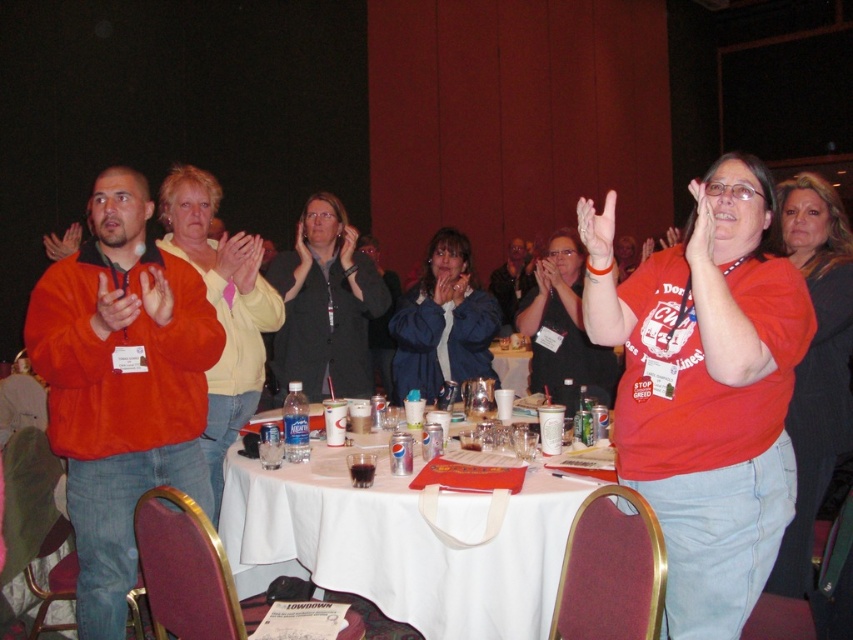
You are attending a formal event in a large hall with red curtains and a dark background. You see an orange fleece jacket at left and a matte black jacket at center. Which jacket is closer to you?

The orange fleece jacket at left is closer to you because it is in front of the matte black jacket at center.

You are a server at a formal event and need to deliver a drink to the person wearing the matte black jacket at center. The drink is in the white paper cup at center. Can you reach the jacket wearer without moving the cup?

The distance between the matte black jacket at center and the white paper cup at center is 1.31 meters. Since the cup is already at the center, you can simply pick up the cup and hand it to the person wearing the matte black jacket at center without needing to move it further.